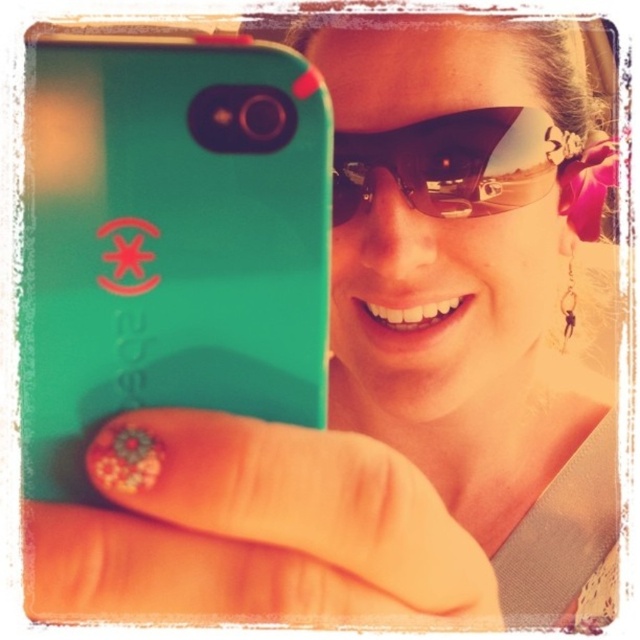
Question: Can you confirm if teal rubberized phone at center is positioned above brown reflective sunglasses at center?

Choices:
 (A) no
 (B) yes

Answer: (A)

Question: Which point is closer to the camera taking this photo?

Choices:
 (A) (305, 332)
 (B) (436, 179)

Answer: (A)

Question: Which point is closer to the camera?

Choices:
 (A) glittery nail art at center
 (B) brown reflective sunglasses at center

Answer: (A)

Question: Which point is closer to the camera?

Choices:
 (A) (145, 340)
 (B) (68, 584)

Answer: (B)

Question: Can you confirm if glittery nail art at center is positioned above brown reflective sunglasses at center?

Choices:
 (A) no
 (B) yes

Answer: (A)

Question: Observing the image, what is the correct spatial positioning of teal rubberized phone at center in reference to brown reflective sunglasses at center?

Choices:
 (A) below
 (B) above

Answer: (A)